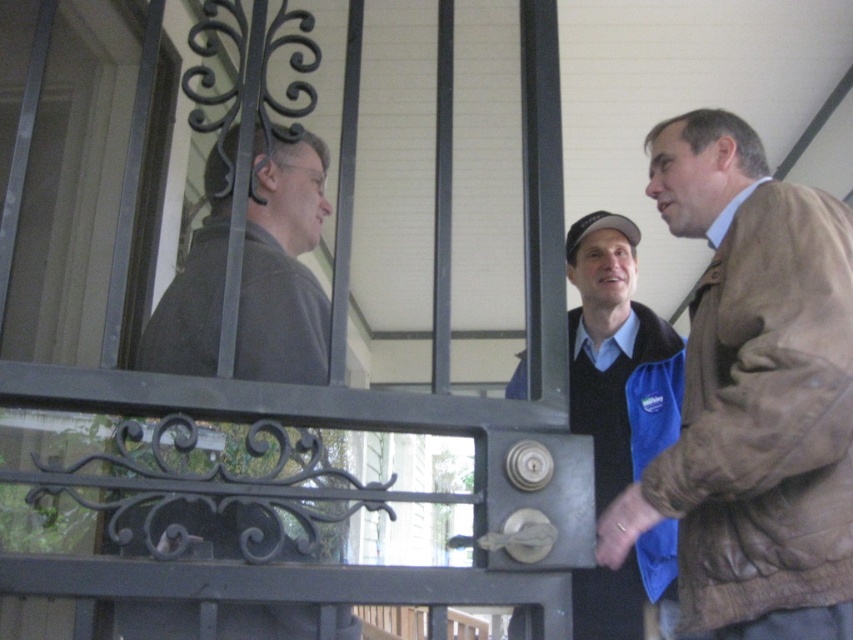
Question: Which is farther from the dark gray jacket at left?

Choices:
 (A) brown leather jacket at right
 (B) blue fabric vest at center

Answer: (B)

Question: Which is farther from the brown leather jacket at right?

Choices:
 (A) blue fabric vest at center
 (B) dark gray jacket at left

Answer: (A)

Question: Does dark gray jacket at left appear on the left side of blue fabric vest at center?

Choices:
 (A) yes
 (B) no

Answer: (A)

Question: Which of the following is the closest to the observer?

Choices:
 (A) (669, 579)
 (B) (688, 483)

Answer: (B)

Question: Does brown leather jacket at right appear on the right side of dark gray jacket at left?

Choices:
 (A) no
 (B) yes

Answer: (B)

Question: In this image, where is dark gray jacket at left located relative to blue fabric vest at center?

Choices:
 (A) below
 (B) above

Answer: (B)